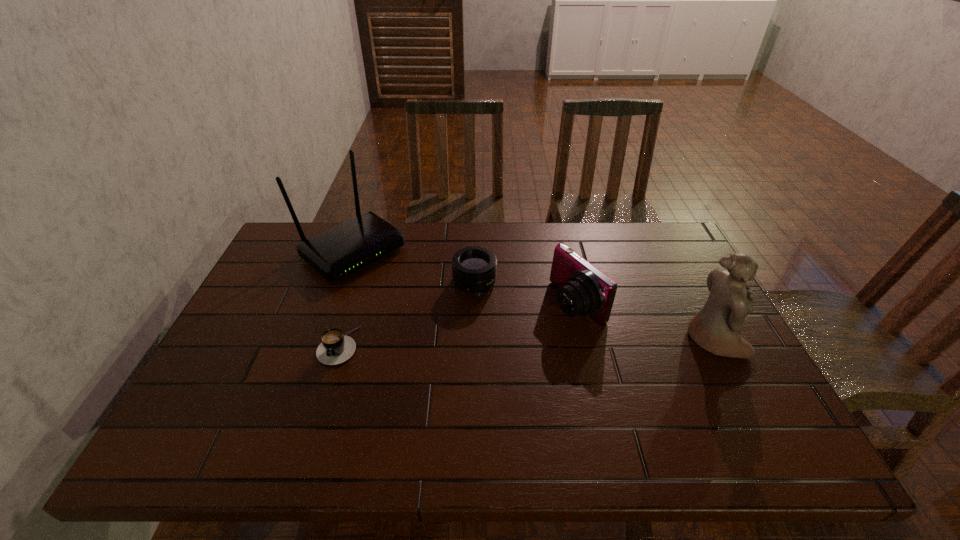
The width and height of the screenshot is (960, 540). Find the location of `vacant space located 0.210m on the front-facing side of the second object from right to left`. vacant space located 0.210m on the front-facing side of the second object from right to left is located at coordinates (493, 352).

Locate an element on the screen. This screenshot has width=960, height=540. vacant space situated 0.320m on the front-facing side of the second object from right to left is located at coordinates [x=456, y=370].

Where is `blank area located 0.070m on the front-facing side of the second object from right to left`? blank area located 0.070m on the front-facing side of the second object from right to left is located at coordinates (538, 329).

The image size is (960, 540). Find the location of `free space located 0.380m on the front-facing side of the router`. free space located 0.380m on the front-facing side of the router is located at coordinates (471, 342).

At what (x,y) coordinates should I click in order to perform the action: click on vacant space located 0.130m on the front-facing side of the router. Please return your answer as a coordinate pair (x, y). The width and height of the screenshot is (960, 540). Looking at the image, I should click on (410, 295).

I want to click on free space located 0.090m on the front-facing side of the router, so click(402, 289).

Locate an element on the screen. The width and height of the screenshot is (960, 540). object present at the far edge is located at coordinates (336, 253).

The width and height of the screenshot is (960, 540). Identify the location of object located at the left edge. (336, 253).

This screenshot has height=540, width=960. In order to click on object that is at the right edge in this screenshot , I will do `click(716, 327)`.

The width and height of the screenshot is (960, 540). In order to click on object situated at the far left corner in this screenshot , I will do `click(336, 253)`.